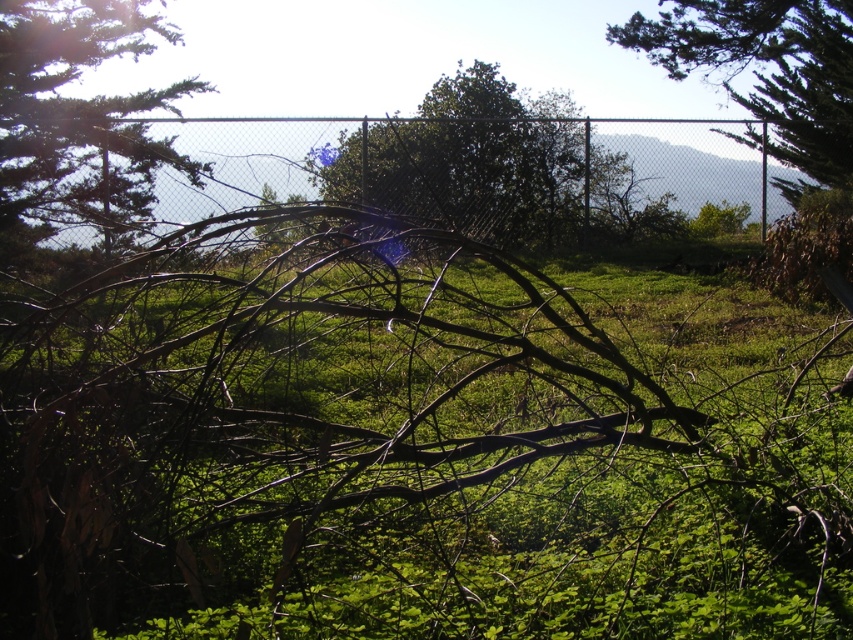
Is green leafy tree at upper left taller than green leafy tree at upper center?

Correct, green leafy tree at upper left is much taller as green leafy tree at upper center.

Which is more to the left, green leafy tree at upper left or green leafy tree at upper center?

green leafy tree at upper left

Is point (146, 17) in front of point (846, 32)?

Yes, point (146, 17) is closer to viewer.

The width and height of the screenshot is (853, 640). I want to click on green leafy tree at upper left, so click(x=74, y=122).

From the picture: Between metallic chain-link fence at center and green leafy tree at upper center, which one appears on the right side from the viewer's perspective?

From the viewer's perspective, green leafy tree at upper center appears more on the right side.

Is point (607, 145) less distant than point (814, 188)?

Yes.

Is point (299, 161) in front of point (726, 61)?

Yes, point (299, 161) is in front of point (726, 61).

Locate an element on the screen. This screenshot has width=853, height=640. metallic chain-link fence at center is located at coordinates (381, 172).

Is green leafy tree at center bigger than green leafy tree at upper center?

Yes.

Is point (474, 90) closer to camera compared to point (830, 179)?

Yes, it is in front of point (830, 179).

This screenshot has height=640, width=853. In order to click on green leafy tree at center in this screenshot , I will do `click(469, 163)`.